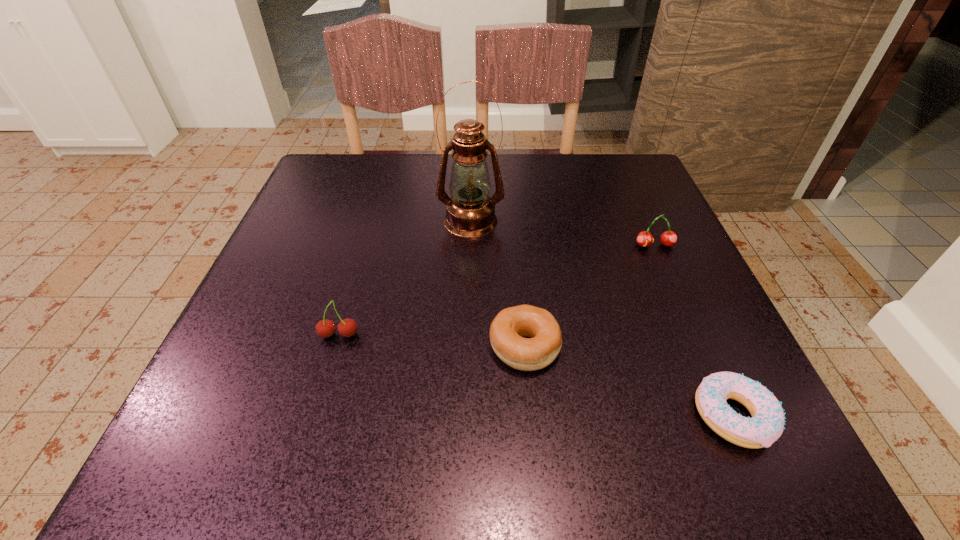
The width and height of the screenshot is (960, 540). I want to click on vacant area that satisfies the following two spatial constraints: 1. with stems pointing upwards on the nearest object; 2. on the right side of the farther cherry, so (730, 416).

Where is `vacant space that satisfies the following two spatial constraints: 1. on the surface of the left cherry; 2. on the left side of the nearest object`? vacant space that satisfies the following two spatial constraints: 1. on the surface of the left cherry; 2. on the left side of the nearest object is located at coordinates (315, 416).